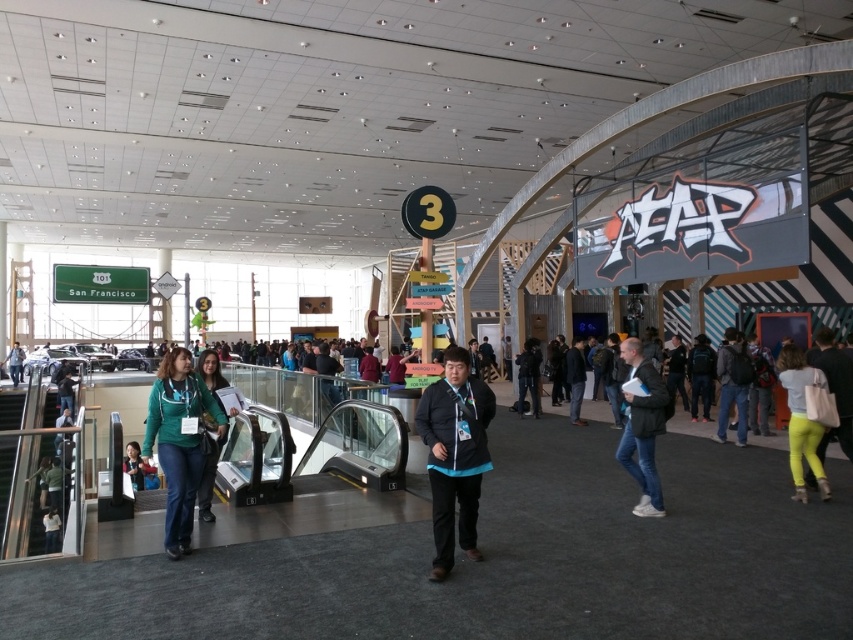
You are an event organizer at the convention center and need to determine if the green fabric jacket at lower left can be stored in a locker that is 1.2 meters tall. The white leather jacket at lower right also needs storage. Can both jackets fit vertically in the locker?

The green fabric jacket at lower left is shorter than the white leather jacket at lower right. Since the locker is 1.2 meters tall, both jackets can fit vertically as the taller white leather jacket at lower right is likely under 1.2 meters. However, if the white leather jacket at lower right exceeds 1.2 meters, it might not fit. The exact height of each jacket isn not provided, so we can only assume based on their relative sizes.

You are standing in the convention center and see the white leather jacket at lower right and the dark gray backpack at right. Which item is positioned higher from the ground?

The white leather jacket at lower right is located above the dark gray backpack at right, so it is positioned higher from the ground.

You are standing in the convention center and see both the green fabric jacket at lower left and the denim jacket at lower left. Which jacket is nearer to you?

The green fabric jacket at lower left is closer to the viewer than the denim jacket at lower left, so the green fabric jacket at lower left is nearer to you.